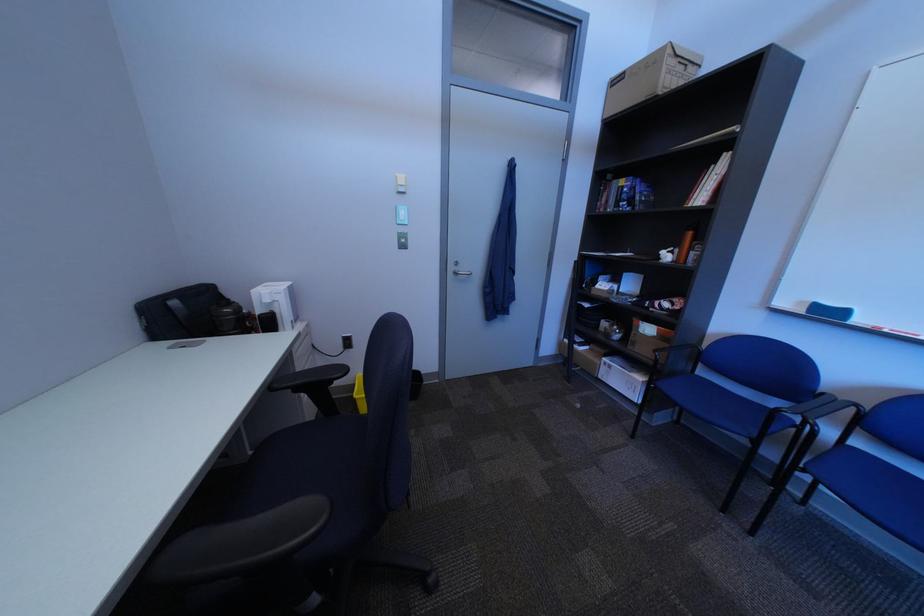
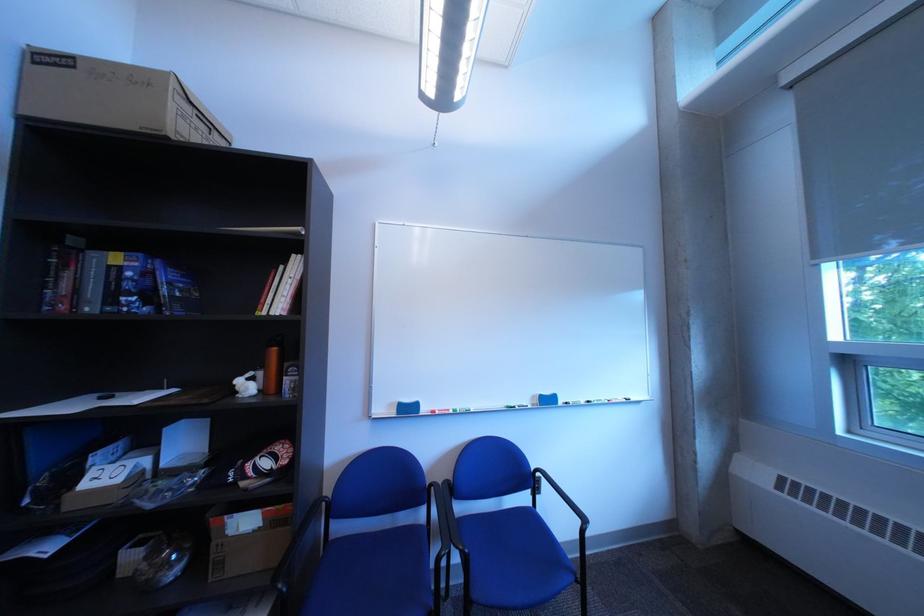
Where in the second image is the point corresponding to point 816,305 from the first image?

(406, 407)